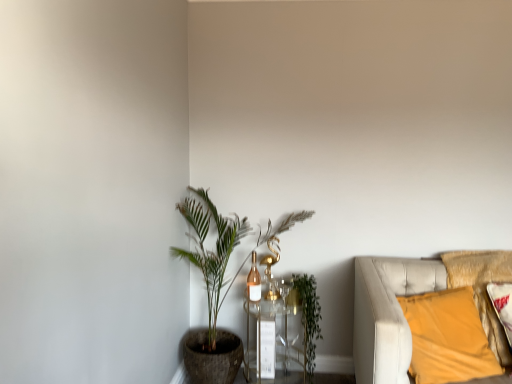
Question: From a real-world perspective, is green leafy plant at center-left positioned above or below clear glass table at center?

Choices:
 (A) below
 (B) above

Answer: (B)

Question: From the image's perspective, is green leafy plant at center-left positioned above or below clear glass table at center?

Choices:
 (A) below
 (B) above

Answer: (B)

Question: Which object is positioned closest to the clear glass table at center?

Choices:
 (A) green leafy plant at center-left
 (B) green leafy plant at center
 (C) velvet yellow pillow at right

Answer: (B)

Question: Which object is positioned farthest from the green leafy plant at center-left?

Choices:
 (A) green leafy plant at center
 (B) clear glass table at center
 (C) velvet yellow pillow at right

Answer: (C)